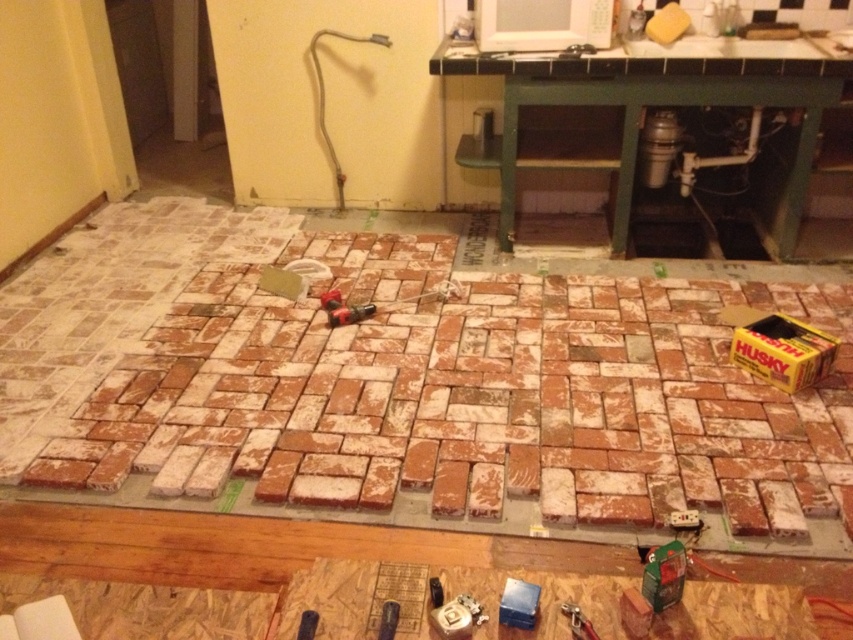
Is metallic red drill at center below metallic silver screwdriver at center?

Actually, metallic red drill at center is above metallic silver screwdriver at center.

In the scene shown: Who is lower down, metallic red drill at center or metallic silver screwdriver at center?

metallic silver screwdriver at center is lower down.

Image resolution: width=853 pixels, height=640 pixels. Describe the element at coordinates (343, 308) in the screenshot. I see `metallic red drill at center` at that location.

You are a GUI agent. You are given a task and a screenshot of the screen. Output one action in this format:
    pyautogui.click(x=<x>, y=<y>)
    Task: Click on the metallic red drill at center
    
    Given the screenshot: What is the action you would take?
    pyautogui.click(x=343, y=308)

Which is below, terracotta clay bricks at center or metallic blue screwdriver at lower center?

metallic blue screwdriver at lower center is below.

Is terracotta clay bricks at center thinner than metallic blue screwdriver at lower center?

Incorrect, terracotta clay bricks at center's width is not less than metallic blue screwdriver at lower center's.

This screenshot has height=640, width=853. What do you see at coordinates (407, 388) in the screenshot?
I see `terracotta clay bricks at center` at bounding box center [407, 388].

What are the coordinates of `terracotta clay bricks at center` in the screenshot? It's located at (407, 388).

Does terracotta clay bricks at center appear on the right side of metallic silver wrench at lower center?

In fact, terracotta clay bricks at center is to the left of metallic silver wrench at lower center.

In the scene shown: Who is more distant from viewer, (163, 237) or (596, 637)?

The point (163, 237) is behind.

Is point (753, 396) farther from viewer compared to point (563, 612)?

Yes, it is.

I want to click on terracotta clay bricks at center, so tap(407, 388).